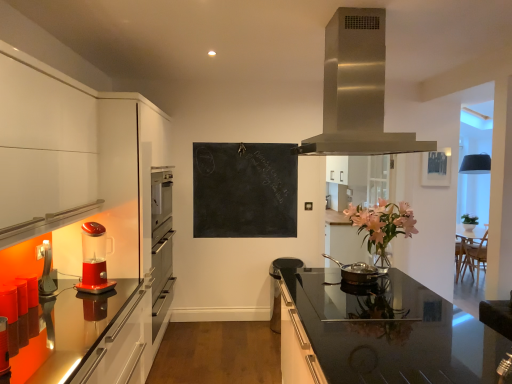
Question: Would you say translucent red blender at left, which is the 1th kitchen appliance from left to right, is to the left or to the right of black chalkboard at center in the picture?

Choices:
 (A) left
 (B) right

Answer: (A)

Question: From the image's perspective, relative to black chalkboard at center, is translucent red blender at left, which is the 1th kitchen appliance from left to right, above or below?

Choices:
 (A) below
 (B) above

Answer: (A)

Question: Estimate the real-world distances between objects in this image. Which object is closer to the translucent red blender at left, which is the 1th kitchen appliance from left to right?

Choices:
 (A) stainless steel range hood at upper center
 (B) metallic silver picture frame at upper right
 (C) black chalkboard at center
 (D) bronze metallic pan at center, which appears as the 2th kitchen appliance when viewed from the left
 (E) black glass countertop at center

Answer: (D)

Question: Estimate the real-world distances between objects in this image. Which object is closer to the metallic silver picture frame at upper right?

Choices:
 (A) black chalkboard at center
 (B) stainless steel range hood at upper center
 (C) bronze metallic pan at center, which appears as the 2th kitchen appliance when viewed from the left
 (D) translucent red blender at left, arranged as the second kitchen appliance when viewed from the right
 (E) black glass countertop at center

Answer: (A)